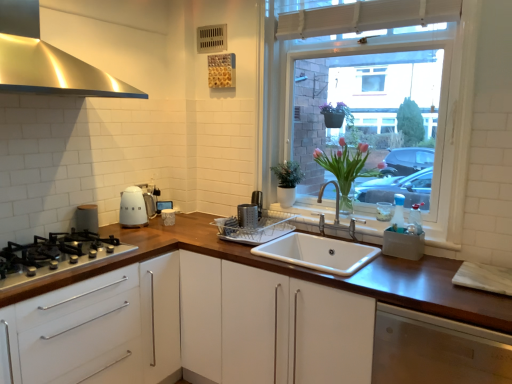
Locate an element on the screen. vacant space underneath matte white kettle at left, which appears as the 2th appliance when viewed from the right (from a real-world perspective) is located at coordinates (138, 230).